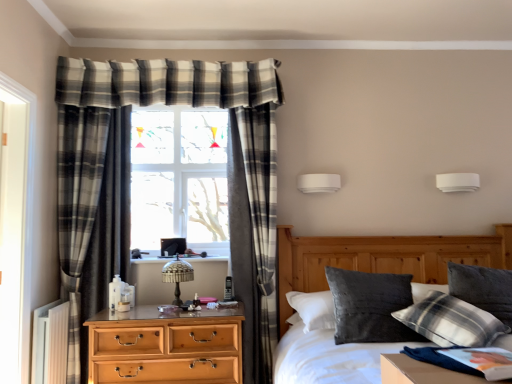
Question: Considering the relative sizes of plaid fabric pillow at upper right, the 2th pillow viewed from the left, and velvet grey pillow at center in the image provided, is plaid fabric pillow at upper right, the 2th pillow viewed from the left, taller than velvet grey pillow at center?

Choices:
 (A) yes
 (B) no

Answer: (B)

Question: Is the position of plaid fabric pillow at upper right, which is the 1th pillow from right to left, less distant than that of velvet grey pillow at center?

Choices:
 (A) yes
 (B) no

Answer: (B)

Question: From the image's perspective, is plaid fabric pillow at upper right, which is the 1th pillow from right to left, beneath velvet grey pillow at center?

Choices:
 (A) yes
 (B) no

Answer: (B)

Question: Considering the relative positions of plaid fabric pillow at upper right, the 2th pillow viewed from the left, and velvet grey pillow at center in the image provided, is plaid fabric pillow at upper right, the 2th pillow viewed from the left, behind velvet grey pillow at center?

Choices:
 (A) yes
 (B) no

Answer: (A)

Question: Considering the relative sizes of plaid fabric pillow at upper right, the 2th pillow viewed from the left, and velvet grey pillow at center in the image provided, is plaid fabric pillow at upper right, the 2th pillow viewed from the left, bigger than velvet grey pillow at center?

Choices:
 (A) no
 (B) yes

Answer: (A)

Question: Is light brown wooden chest of drawers at center left inside the boundaries of translucent glass table lamp at center, or outside?

Choices:
 (A) inside
 (B) outside

Answer: (B)

Question: From the image's perspective, is light brown wooden chest of drawers at center left above or below translucent glass table lamp at center?

Choices:
 (A) below
 (B) above

Answer: (A)

Question: Is light brown wooden chest of drawers at center left taller or shorter than translucent glass table lamp at center?

Choices:
 (A) tall
 (B) short

Answer: (A)

Question: Does point (224, 352) appear closer or farther from the camera than point (176, 299)?

Choices:
 (A) farther
 (B) closer

Answer: (B)

Question: Is velvety dark gray pillow at center-right, marked as the second pillow in a right-to-left arrangement, spatially inside plaid fabric curtain at center, or outside of it?

Choices:
 (A) outside
 (B) inside

Answer: (A)

Question: Considering the positions of velvety dark gray pillow at center-right, the 1th pillow from the left, and plaid fabric curtain at center in the image, is velvety dark gray pillow at center-right, the 1th pillow from the left, taller or shorter than plaid fabric curtain at center?

Choices:
 (A) short
 (B) tall

Answer: (A)

Question: Considering the positions of velvety dark gray pillow at center-right, the 1th pillow from the left, and plaid fabric curtain at center in the image, is velvety dark gray pillow at center-right, the 1th pillow from the left, bigger or smaller than plaid fabric curtain at center?

Choices:
 (A) small
 (B) big

Answer: (A)

Question: From a real-world perspective, relative to plaid fabric curtain at center, is velvety dark gray pillow at center-right, marked as the second pillow in a right-to-left arrangement, vertically above or below?

Choices:
 (A) above
 (B) below

Answer: (B)

Question: From a real-world perspective, is white plastic radiator at lower left positioned above or below plaid fabric pillow at upper right, which is the 1th pillow from right to left?

Choices:
 (A) above
 (B) below

Answer: (B)

Question: Would you say white plastic radiator at lower left is inside or outside plaid fabric pillow at upper right, which is the 1th pillow from right to left?

Choices:
 (A) inside
 (B) outside

Answer: (B)